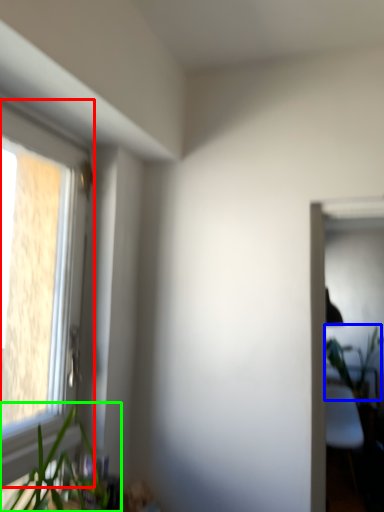
Question: Considering the real-world distances, which object is farthest from window (highlighted by a red box)? vegetation (highlighted by a blue box) or houseplant (highlighted by a green box)?

Choices:
 (A) vegetation
 (B) houseplant

Answer: (A)